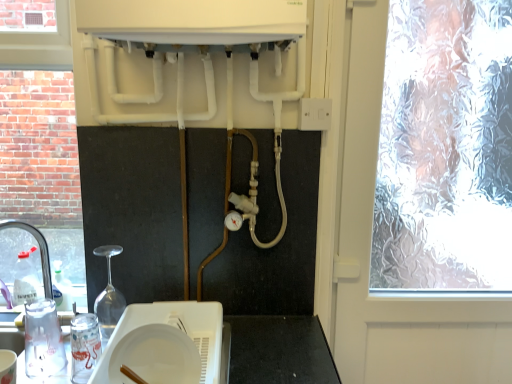
At what (x,y) coordinates should I click in order to perform the action: click on white plastic plate at lower center, the second appliance in the left-to-right sequence. Please return your answer as a coordinate pair (x, y). The width and height of the screenshot is (512, 384). Looking at the image, I should click on (167, 343).

Measure the distance between white plastic plate at lower center, arranged as the first appliance when viewed from the right, and camera.

white plastic plate at lower center, arranged as the first appliance when viewed from the right, is 87.57 centimeters from camera.

The height and width of the screenshot is (384, 512). Describe the element at coordinates (39, 248) in the screenshot. I see `clear plastic tap at left` at that location.

The image size is (512, 384). Describe the element at coordinates (40, 316) in the screenshot. I see `transparent plastic sink at lower left` at that location.

Locate an element on the screen. The image size is (512, 384). white matte plate at center is located at coordinates (155, 357).

Describe the element at coordinates (155, 357) in the screenshot. I see `white matte plate at center` at that location.

Locate an element on the screen. white plastic plate at lower center, the second appliance in the left-to-right sequence is located at coordinates 167,343.

Would you say white plastic plate at lower center, arranged as the first appliance when viewed from the right, is inside or outside frosted glass window at right?

white plastic plate at lower center, arranged as the first appliance when viewed from the right, is not enclosed by frosted glass window at right.

Considering the positions of objects white plastic plate at lower center, arranged as the first appliance when viewed from the right, and frosted glass window at right in the image provided, who is more to the right, white plastic plate at lower center, arranged as the first appliance when viewed from the right, or frosted glass window at right?

frosted glass window at right is more to the right.

From the image's perspective, is white plastic plate at lower center, arranged as the first appliance when viewed from the right, positioned above or below frosted glass window at right?

Clearly, from the image's perspective, white plastic plate at lower center, arranged as the first appliance when viewed from the right, is below frosted glass window at right.

Looking at this image, from the image's perspective, is white plastic switch at upper right beneath clear plastic tap at left?

Actually, white plastic switch at upper right appears above clear plastic tap at left in the image.

Does white plastic switch at upper right turn towards clear plastic tap at left?

No, white plastic switch at upper right is not aimed at clear plastic tap at left.

Which is behind, point (300, 109) or point (49, 279)?

Point (49, 279)

Is white plastic switch at upper right not inside clear plastic tap at left?

Yes, white plastic switch at upper right is not within clear plastic tap at left.

In the scene shown: Is white plastic plate at lower center, arranged as the first appliance when viewed from the right, far from white matte plate at center?

No, white plastic plate at lower center, arranged as the first appliance when viewed from the right, is not far from white matte plate at center.

From the image's perspective, starting from the white matte plate at center, which appliance is the 2nd one below? Please provide its 2D coordinates.

[(167, 343)]

Does point (117, 325) come farther from viewer compared to point (144, 378)?

That is True.

Considering the relative positions of white plastic plate at lower center, the second appliance in the left-to-right sequence, and white matte plate at center in the image provided, is white plastic plate at lower center, the second appliance in the left-to-right sequence, to the left or to the right of white matte plate at center?

white plastic plate at lower center, the second appliance in the left-to-right sequence, is to the left of white matte plate at center.

Based on the photo, is white plastic plate at lower center, arranged as the first appliance when viewed from the right, looking in the opposite direction of transparent plastic cup at lower left, acting as the first appliance starting from the left?

white plastic plate at lower center, arranged as the first appliance when viewed from the right, does not have its back to transparent plastic cup at lower left, acting as the first appliance starting from the left.

Is white plastic plate at lower center, the second appliance in the left-to-right sequence, further to the viewer compared to transparent plastic cup at lower left, acting as the first appliance starting from the left?

No, it is not.

How different are the orientations of white plastic plate at lower center, arranged as the first appliance when viewed from the right, and transparent plastic cup at lower left, the second appliance from the right, in degrees?

There is a 3.65-degree angle between the facing directions of white plastic plate at lower center, arranged as the first appliance when viewed from the right, and transparent plastic cup at lower left, the second appliance from the right.

Consider the image. Could transparent plastic cup at lower left, the second appliance from the right, be considered to be inside white plastic plate at lower center, arranged as the first appliance when viewed from the right?

Definitely not — transparent plastic cup at lower left, the second appliance from the right, is not inside white plastic plate at lower center, arranged as the first appliance when viewed from the right.

From the image's perspective, which one is positioned higher, frosted glass window at right or transparent plastic sink at lower left?

frosted glass window at right.

Is frosted glass window at right to the right of transparent plastic sink at lower left from the viewer's perspective?

Indeed, frosted glass window at right is positioned on the right side of transparent plastic sink at lower left.

Is transparent plastic sink at lower left located within frosted glass window at right?

Result: Definitely not — transparent plastic sink at lower left is not inside frosted glass window at right.

In the scene shown: Is frosted glass window at right positioned with its back to transparent plastic sink at lower left?

No, frosted glass window at right is not facing away from transparent plastic sink at lower left.

Looking at this image, is transparent plastic sink at lower left smaller than white plastic switch at upper right?

No.

Is white plastic switch at upper right at the back of transparent plastic sink at lower left?

No, transparent plastic sink at lower left is not facing the opposite direction of white plastic switch at upper right.

From a real-world perspective, is transparent plastic sink at lower left beneath white plastic switch at upper right?

Indeed, from a real-world perspective, transparent plastic sink at lower left is positioned beneath white plastic switch at upper right.

From the picture: Is transparent plastic sink at lower left closer to the viewer compared to white plastic switch at upper right?

Yes, transparent plastic sink at lower left is in front of white plastic switch at upper right.

Which object is closer to the camera taking this photo, transparent plastic sink at lower left or frosted glass window at right?

transparent plastic sink at lower left.

From the image's perspective, is transparent plastic sink at lower left above or below frosted glass window at right?

transparent plastic sink at lower left is below frosted glass window at right.

Between transparent plastic sink at lower left and frosted glass window at right, which one has less height?

Standing shorter between the two is transparent plastic sink at lower left.

You are a GUI agent. You are given a task and a screenshot of the screen. Output one action in this format:
    pyautogui.click(x=<x>, y=<y>)
    Task: Click on the appliance that is the 2nd object located below the frosted glass window at right (from the image's perspective)
    
    Given the screenshot: What is the action you would take?
    (x=167, y=343)

At what (x,y) coordinates should I click in order to perform the action: click on tap that appears on the left of white plastic switch at upper right. Please return your answer as a coordinate pair (x, y). The height and width of the screenshot is (384, 512). Looking at the image, I should click on (39, 248).

Which object lies further to the anchor point white matte plate at center, white plastic switch at upper right or white plastic plate at lower center, arranged as the first appliance when viewed from the right?

Based on the image, white plastic switch at upper right appears to be further to white matte plate at center.

Looking at the image, which one is located further to transparent plastic cup at lower left, acting as the first appliance starting from the left, frosted glass window at right or white plastic plate at lower center, the second appliance in the left-to-right sequence?

Answer: frosted glass window at right.

Consider the image. Based on their spatial positions, is frosted glass window at right or white plastic plate at lower center, the second appliance in the left-to-right sequence, further from clear plastic tap at left?

frosted glass window at right lies further to clear plastic tap at left than the other object.

Estimate the real-world distances between objects in this image. Which object is further from transparent plastic cup at lower left, the second appliance from the right, white plastic switch at upper right or white plastic plate at lower center, the second appliance in the left-to-right sequence?

white plastic switch at upper right.

Which object lies nearer to the anchor point frosted glass window at right, white plastic plate at lower center, the second appliance in the left-to-right sequence, or transparent plastic cup at lower left, the second appliance from the right?

white plastic plate at lower center, the second appliance in the left-to-right sequence, is closer to frosted glass window at right.

Which object lies further to the anchor point frosted glass window at right, white matte plate at center or clear plastic tap at left?

white matte plate at center is positioned further to the anchor frosted glass window at right.

Based on their spatial positions, is clear plastic tap at left or white plastic plate at lower center, the second appliance in the left-to-right sequence, further from white plastic switch at upper right?

clear plastic tap at left is positioned further to the anchor white plastic switch at upper right.

From the picture: Considering their positions, is transparent plastic sink at lower left positioned further to frosted glass window at right than white plastic switch at upper right?

transparent plastic sink at lower left is further to frosted glass window at right.

The height and width of the screenshot is (384, 512). Find the location of `appliance located between clear plastic tap at left and white plastic plate at lower center, arranged as the first appliance when viewed from the right, in the left-right direction`. appliance located between clear plastic tap at left and white plastic plate at lower center, arranged as the first appliance when viewed from the right, in the left-right direction is located at coordinates (84, 346).

This screenshot has height=384, width=512. Find the location of `electric outlet between white matte plate at center and frosted glass window at right`. electric outlet between white matte plate at center and frosted glass window at right is located at coordinates (314, 114).

This screenshot has height=384, width=512. What are the coordinates of `sink between clear plastic tap at left and frosted glass window at right` in the screenshot? It's located at (40, 316).

This screenshot has width=512, height=384. I want to click on appliance that lies between white plastic switch at upper right and white plastic plate at lower center, the second appliance in the left-to-right sequence, from top to bottom, so click(84, 346).